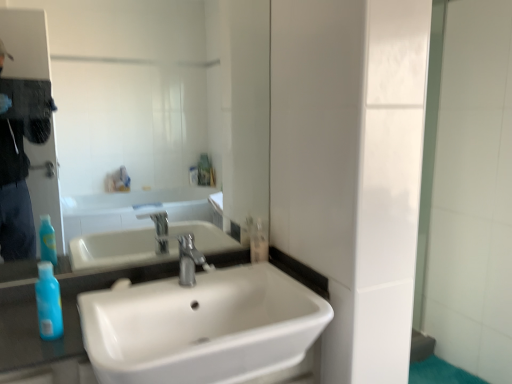
Find the location of `free space that is to the left of clear plastic bottle at center, which is the 1th mouthwash from back to front`. free space that is to the left of clear plastic bottle at center, which is the 1th mouthwash from back to front is located at coordinates (222, 261).